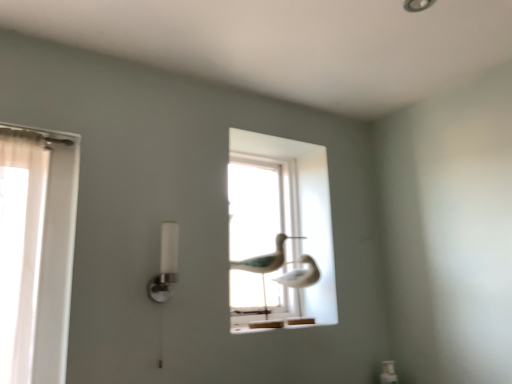
Question: Should I look upward or downward to see white matte bird at center?

Choices:
 (A) up
 (B) down

Answer: (B)

Question: Does white frosted glass lamp at center left contain white matte bird at center?

Choices:
 (A) yes
 (B) no

Answer: (B)

Question: Is white frosted glass lamp at center left not close to white matte bird at center?

Choices:
 (A) yes
 (B) no

Answer: (B)

Question: From the image's perspective, does white frosted glass lamp at center left appear lower than white matte bird at center?

Choices:
 (A) yes
 (B) no

Answer: (B)

Question: Can you confirm if white frosted glass lamp at center left is positioned to the right of white matte bird at center?

Choices:
 (A) no
 (B) yes

Answer: (A)

Question: Are white frosted glass lamp at center left and white matte bird at center making contact?

Choices:
 (A) no
 (B) yes

Answer: (A)

Question: From a real-world perspective, is white frosted glass lamp at center left on white matte bird at center?

Choices:
 (A) yes
 (B) no

Answer: (A)

Question: From a real-world perspective, is transparent glass birds at center physically below white matte bird at center?

Choices:
 (A) no
 (B) yes

Answer: (A)

Question: Can you confirm if transparent glass birds at center is smaller than white matte bird at center?

Choices:
 (A) no
 (B) yes

Answer: (A)

Question: Is transparent glass birds at center far from white matte bird at center?

Choices:
 (A) no
 (B) yes

Answer: (A)

Question: Is the surface of transparent glass birds at center in direct contact with white matte bird at center?

Choices:
 (A) no
 (B) yes

Answer: (A)

Question: Considering the relative positions of transparent glass birds at center and white matte bird at center in the image provided, is transparent glass birds at center behind white matte bird at center?

Choices:
 (A) yes
 (B) no

Answer: (A)

Question: Would you say white matte bird at center is part of transparent glass birds at center's contents?

Choices:
 (A) yes
 (B) no

Answer: (B)

Question: Is white frosted glass lamp at center left at the right side of transparent glass birds at center?

Choices:
 (A) no
 (B) yes

Answer: (A)